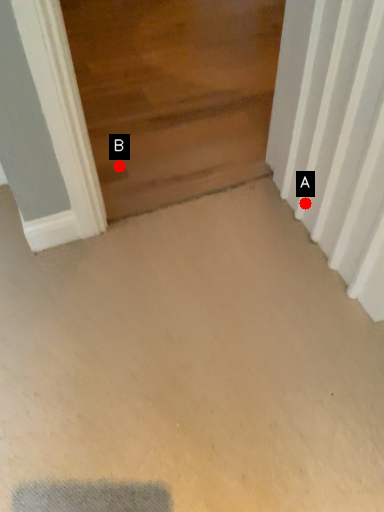
Question: Two points are circled on the image, labeled by A and B beside each circle. Which point is further to the camera?

Choices:
 (A) A is further
 (B) B is further

Answer: (B)